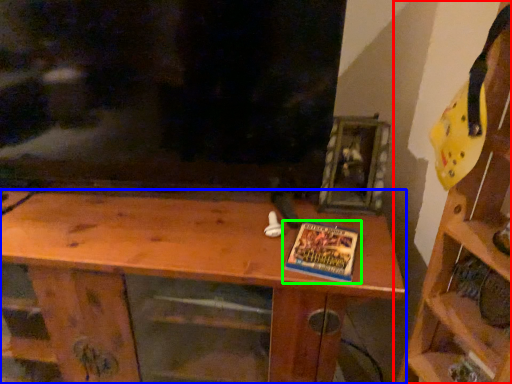
Question: Which is nearer to the shelf (highlighted by a red box)? shelf (highlighted by a blue box) or book (highlighted by a green box).

Choices:
 (A) shelf
 (B) book

Answer: (B)